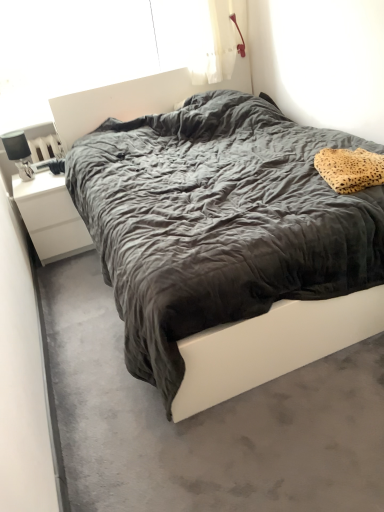
This screenshot has height=512, width=384. Find the location of `vacant area that lies between white matte nightstand at left and velvet dark gray bed at center`. vacant area that lies between white matte nightstand at left and velvet dark gray bed at center is located at coordinates (86, 307).